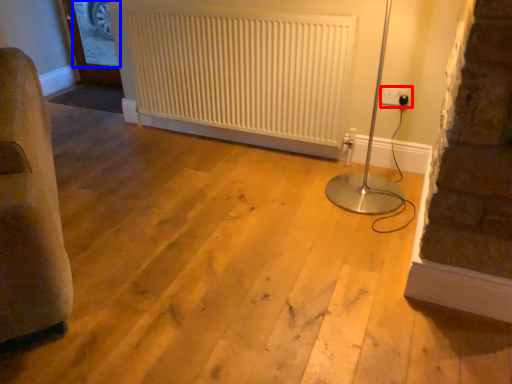
Question: Among these objects, which one is farthest to the camera, electric outlet (highlighted by a red box) or window screen (highlighted by a blue box)?

Choices:
 (A) electric outlet
 (B) window screen

Answer: (B)